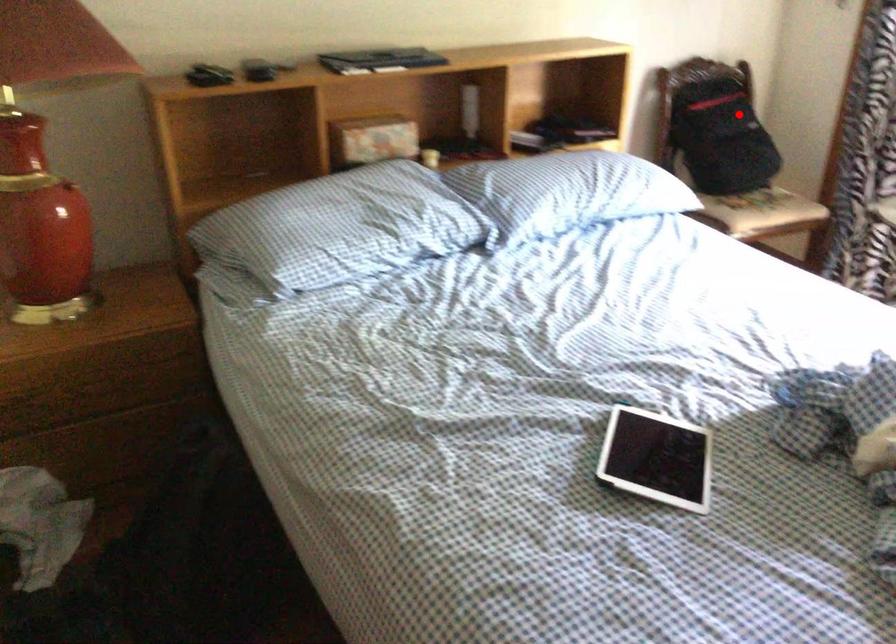
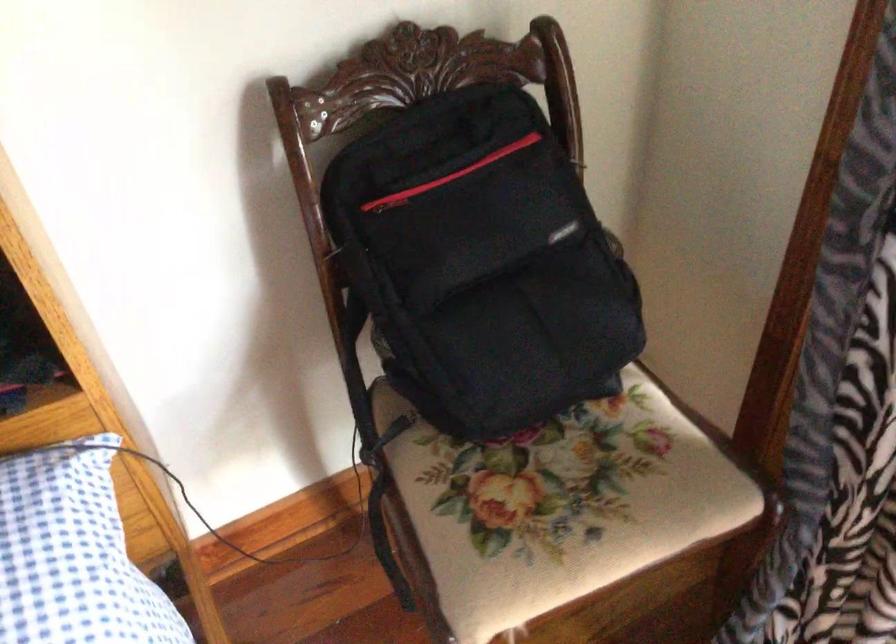
Question: I am providing you with two images of the same scene from different viewpoints. Given a red point in image1, look at the same physical point in image2. Is it:

Choices:
 (A) Closer to the viewpoint
 (B) Farther from the viewpoint

Answer: (A)